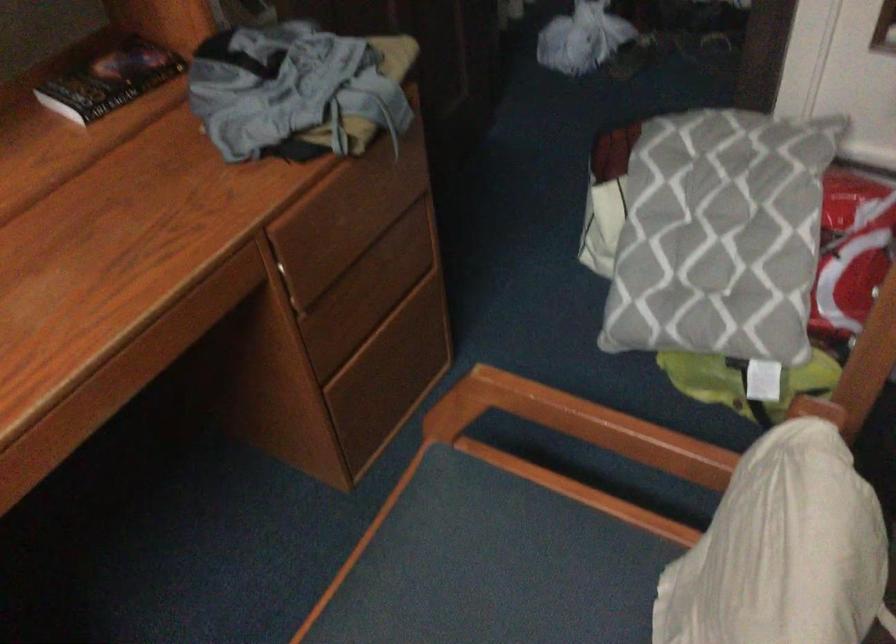
This screenshot has width=896, height=644. Find the location of `drawer pull`. drawer pull is located at coordinates (299, 276).